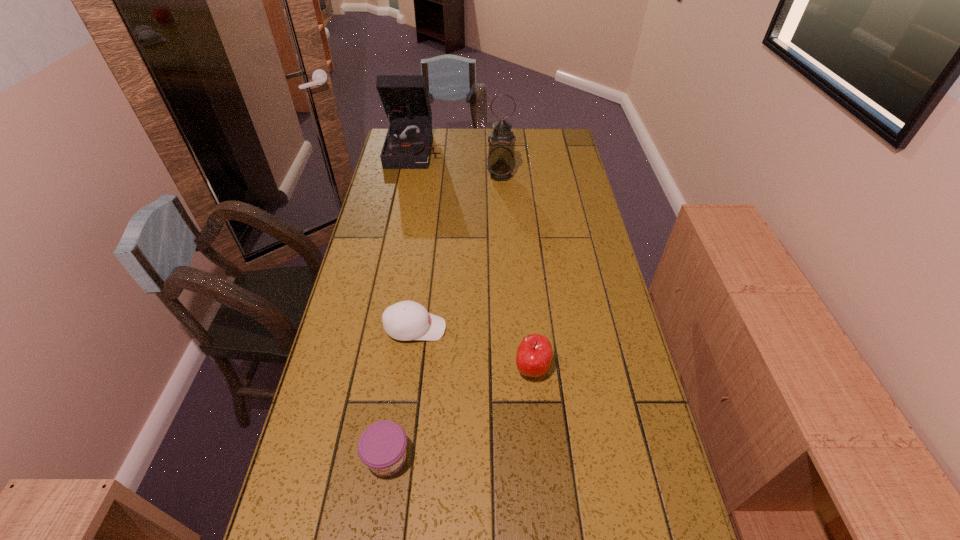
Where is `free space between the fourth farthest object and the jam`? This screenshot has height=540, width=960. free space between the fourth farthest object and the jam is located at coordinates (460, 414).

The image size is (960, 540). Identify the location of vacant area that lies between the third farthest object and the phonograph_record. (416, 239).

The height and width of the screenshot is (540, 960). What are the coordinates of `empty location between the oil lamp and the jam` in the screenshot? It's located at (444, 317).

Identify the location of free space between the jam and the fourth farthest object. The height and width of the screenshot is (540, 960). (460, 414).

You are a GUI agent. You are given a task and a screenshot of the screen. Output one action in this format:
    pyautogui.click(x=<x>, y=<y>)
    Task: Click on the vacant area that lies between the apple and the phonograph_record
    
    Given the screenshot: What is the action you would take?
    pyautogui.click(x=473, y=259)

Where is `free space between the jam and the oil lamp`? The width and height of the screenshot is (960, 540). free space between the jam and the oil lamp is located at coordinates (444, 317).

The width and height of the screenshot is (960, 540). I want to click on object that is the fourth closest to the phonograph_record, so click(382, 446).

At what (x,y) coordinates should I click in order to perform the action: click on object that is the third closest one to the oil lamp. Please return your answer as a coordinate pair (x, y). This screenshot has height=540, width=960. Looking at the image, I should click on (534, 354).

You are a GUI agent. You are given a task and a screenshot of the screen. Output one action in this format:
    pyautogui.click(x=<x>, y=<y>)
    Task: Click on the vacant region that satisfies the following two spatial constraints: 1. on the front-facing side of the phonograph_record; 2. on the left side of the third tallest object
    This screenshot has height=540, width=960.
    Given the screenshot: What is the action you would take?
    pyautogui.click(x=372, y=369)

This screenshot has height=540, width=960. I want to click on vacant region that satisfies the following two spatial constraints: 1. on the back side of the third shortest object; 2. on the front-facing side of the third farthest object, so click(528, 328).